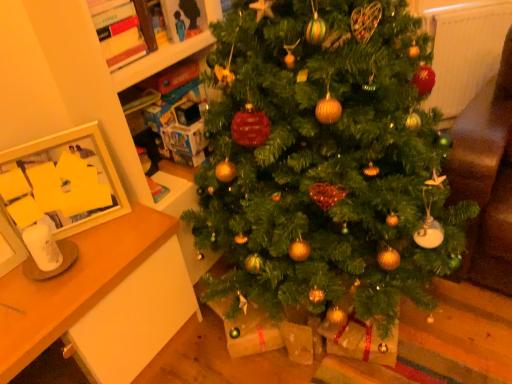
Image resolution: width=512 pixels, height=384 pixels. Describe the element at coordinates (325, 161) in the screenshot. I see `green matte christmas tree at center` at that location.

In order to click on white textured radiator at upper right in this screenshot , I will do `click(465, 50)`.

What do you see at coordinates (465, 50) in the screenshot?
I see `white textured radiator at upper right` at bounding box center [465, 50].

Measure the distance between wooden desk at left and camera.

The distance of wooden desk at left from camera is 95.60 centimeters.

What do you see at coordinates (160, 60) in the screenshot? I see `cardboard boxes at upper left` at bounding box center [160, 60].

In order to face cardboard boxes at upper left, should I rotate leftwards or rightwards?

A 8.529 degree turn to the left will do.

Find the location of a particular element. Image resolution: width=512 pixels, height=384 pixels. white glossy picture frame at left is located at coordinates (72, 178).

Does wooden desk at left have a smaller size compared to green matte christmas tree at center?

Correct, wooden desk at left occupies less space than green matte christmas tree at center.

Based on the photo, is wooden desk at left closer to the viewer compared to green matte christmas tree at center?

No, wooden desk at left is behind green matte christmas tree at center.

Would you say wooden desk at left is outside green matte christmas tree at center?

wooden desk at left lies outside green matte christmas tree at center's area.

The height and width of the screenshot is (384, 512). What are the coordinates of `christmas tree in front of the wooden desk at left` in the screenshot? It's located at (325, 161).

Can you confirm if white glossy picture frame at left is smaller than white textured radiator at upper right?

Yes.

Is white glossy picture frame at left oriented away from white textured radiator at upper right?

No, white glossy picture frame at left is not facing the opposite direction of white textured radiator at upper right.

In the image, there is a white glossy picture frame at left. Where is `radiator below it (from a real-world perspective)`? The width and height of the screenshot is (512, 384). radiator below it (from a real-world perspective) is located at coordinates (465, 50).

Considering the relative sizes of white glossy picture frame at left and white textured radiator at upper right in the image provided, is white glossy picture frame at left wider than white textured radiator at upper right?

Incorrect, the width of white glossy picture frame at left does not surpass that of white textured radiator at upper right.

Is white textured radiator at upper right not within wooden desk at left?

Absolutely, white textured radiator at upper right is external to wooden desk at left.

Which is behind, point (468, 26) or point (122, 272)?

Point (468, 26)

From the image's perspective, which object appears higher, white textured radiator at upper right or wooden desk at left?

white textured radiator at upper right.

Is white textured radiator at upper right bigger than green matte christmas tree at center?

No.

Between white textured radiator at upper right and green matte christmas tree at center, which one has smaller width?

white textured radiator at upper right.

Which is more to the right, white textured radiator at upper right or green matte christmas tree at center?

white textured radiator at upper right is more to the right.

From the image's perspective, which one is positioned lower, cardboard boxes at upper left or white glossy picture frame at left?

From the image's view, white glossy picture frame at left is below.

Between cardboard boxes at upper left and white glossy picture frame at left, which one appears on the right side from the viewer's perspective?

cardboard boxes at upper left.

Which of these two, cardboard boxes at upper left or white glossy picture frame at left, is bigger?

cardboard boxes at upper left.

From a real-world perspective, is cardboard boxes at upper left over white glossy picture frame at left?

No, from a real-world perspective, cardboard boxes at upper left is not on top of white glossy picture frame at left.

From the picture: Can you tell me how much white glossy picture frame at left and green matte christmas tree at center differ in facing direction?

62.7 degrees.

From a real-world perspective, does white glossy picture frame at left stand above green matte christmas tree at center?

Correct, in the physical world, white glossy picture frame at left is higher than green matte christmas tree at center.

Which is behind, point (12, 163) or point (364, 259)?

The point (364, 259) is behind.

Between white glossy picture frame at left and green matte christmas tree at center, which one appears on the right side from the viewer's perspective?

From the viewer's perspective, green matte christmas tree at center appears more on the right side.

Does white textured radiator at upper right appear on the left side of cardboard boxes at upper left?

No.

Is the surface of white textured radiator at upper right in direct contact with cardboard boxes at upper left?

No, white textured radiator at upper right is not touching cardboard boxes at upper left.

Locate an element on the screen. bookshelf below the white textured radiator at upper right (from the image's perspective) is located at coordinates (160, 60).

Which object is closer to the camera taking this photo, white textured radiator at upper right or cardboard boxes at upper left?

cardboard boxes at upper left is in front.

The image size is (512, 384). Find the location of `desk behind the green matte christmas tree at center`. desk behind the green matte christmas tree at center is located at coordinates 100,296.

Locate an element on the screen. This screenshot has width=512, height=384. picture frame below the white textured radiator at upper right (from the image's perspective) is located at coordinates (72, 178).

Which object lies nearer to the anchor point green matte christmas tree at center, wooden desk at left or cardboard boxes at upper left?

wooden desk at left lies closer to green matte christmas tree at center than the other object.

When comparing their distances from white textured radiator at upper right, does wooden desk at left or green matte christmas tree at center seem further?

wooden desk at left lies further to white textured radiator at upper right than the other object.

Estimate the real-world distances between objects in this image. Which object is closer to green matte christmas tree at center, cardboard boxes at upper left or white glossy picture frame at left?

Based on the image, cardboard boxes at upper left appears to be nearer to green matte christmas tree at center.

Which object lies further to the anchor point white textured radiator at upper right, cardboard boxes at upper left or green matte christmas tree at center?

cardboard boxes at upper left.

Estimate the real-world distances between objects in this image. Which object is further from wooden desk at left, white glossy picture frame at left or white textured radiator at upper right?

white textured radiator at upper right is further to wooden desk at left.

Looking at the image, which one is located further to white textured radiator at upper right, wooden desk at left or white glossy picture frame at left?

wooden desk at left lies further to white textured radiator at upper right than the other object.

When comparing their distances from green matte christmas tree at center, does cardboard boxes at upper left or white textured radiator at upper right seem closer?

Among the two, cardboard boxes at upper left is located nearer to green matte christmas tree at center.

In the scene shown: Estimate the real-world distances between objects in this image. Which object is further from white glossy picture frame at left, wooden desk at left or cardboard boxes at upper left?

cardboard boxes at upper left is positioned further to the anchor white glossy picture frame at left.

Find the location of a particular element. Image resolution: width=512 pixels, height=384 pixels. desk between green matte christmas tree at center and white textured radiator at upper right from front to back is located at coordinates (100, 296).

I want to click on picture frame located between green matte christmas tree at center and cardboard boxes at upper left in the depth direction, so click(72, 178).

Image resolution: width=512 pixels, height=384 pixels. I want to click on desk between white glossy picture frame at left and white textured radiator at upper right in the horizontal direction, so click(x=100, y=296).

This screenshot has height=384, width=512. Identify the location of christmas tree between white glossy picture frame at left and white textured radiator at upper right from left to right. (325, 161).